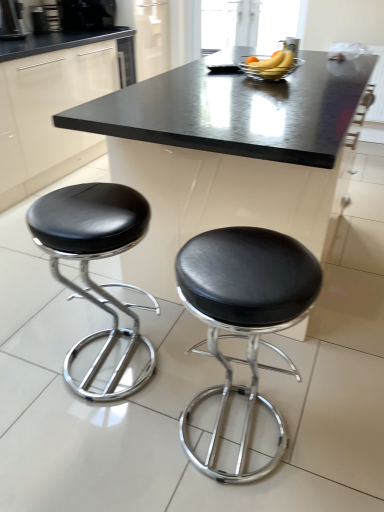
Question: Can you confirm if black leather stool at lower right, marked as the first stool in a right-to-left arrangement, is bigger than metallic silver coffee maker at upper left, the 1th appliance from the left?

Choices:
 (A) no
 (B) yes

Answer: (B)

Question: Does black leather stool at lower right, marked as the first stool in a right-to-left arrangement, have a lesser height compared to metallic silver coffee maker at upper left, the 1th appliance from the left?

Choices:
 (A) yes
 (B) no

Answer: (B)

Question: Is black leather stool at lower right, marked as the 2th stool in a left-to-right arrangement, not close to metallic silver coffee maker at upper left, the 1th appliance from the left?

Choices:
 (A) yes
 (B) no

Answer: (A)

Question: Is metallic silver coffee maker at upper left, the 1th appliance from the left, completely or partially inside black leather stool at lower right, marked as the 2th stool in a left-to-right arrangement?

Choices:
 (A) no
 (B) yes

Answer: (A)

Question: From the image's perspective, is black leather stool at lower right, marked as the first stool in a right-to-left arrangement, on metallic silver coffee maker at upper left, placed as the 2th appliance when sorted from right to left?

Choices:
 (A) no
 (B) yes

Answer: (A)

Question: From a real-world perspective, is black leather stool at lower right, marked as the first stool in a right-to-left arrangement, physically below metallic silver coffee maker at upper left, the 1th appliance from the left?

Choices:
 (A) no
 (B) yes

Answer: (B)

Question: Is black plastic coffee machine at upper left, which appears as the 2th coffee machine when viewed from the top, oriented towards black leather stool at lower right, marked as the 2th stool in a left-to-right arrangement?

Choices:
 (A) yes
 (B) no

Answer: (B)

Question: Does black plastic coffee machine at upper left, which appears as the 1th coffee machine when viewed from the left, lie in front of black leather stool at lower right, marked as the 2th stool in a left-to-right arrangement?

Choices:
 (A) no
 (B) yes

Answer: (A)

Question: Is black plastic coffee machine at upper left, which is the first coffee machine in front-to-back order, shorter than black leather stool at lower right, marked as the first stool in a right-to-left arrangement?

Choices:
 (A) no
 (B) yes

Answer: (B)

Question: Considering the relative sizes of black plastic coffee machine at upper left, the first coffee machine positioned from the bottom, and black leather stool at lower right, marked as the 2th stool in a left-to-right arrangement, in the image provided, is black plastic coffee machine at upper left, the first coffee machine positioned from the bottom, bigger than black leather stool at lower right, marked as the 2th stool in a left-to-right arrangement,?

Choices:
 (A) no
 (B) yes

Answer: (A)

Question: Is black plastic coffee machine at upper left, the first coffee machine positioned from the bottom, far away from black leather stool at lower right, marked as the 2th stool in a left-to-right arrangement?

Choices:
 (A) no
 (B) yes

Answer: (B)

Question: Does black plastic coffee machine at upper left, the first coffee machine positioned from the bottom, have a lesser width compared to black leather stool at lower right, marked as the first stool in a right-to-left arrangement?

Choices:
 (A) no
 (B) yes

Answer: (B)

Question: Can you confirm if black plastic coffee machine at upper left, which appears as the 1th coffee machine when viewed from the left, is positioned to the right of black leather stool at left, the 2th stool in the right-to-left sequence?

Choices:
 (A) yes
 (B) no

Answer: (B)